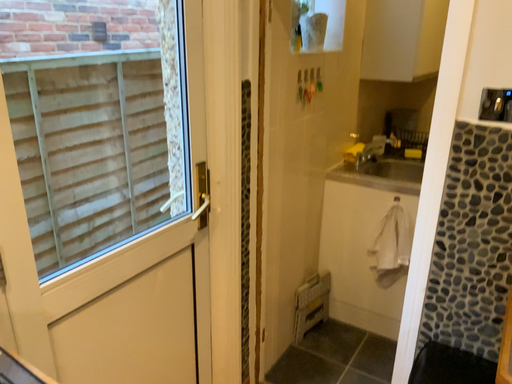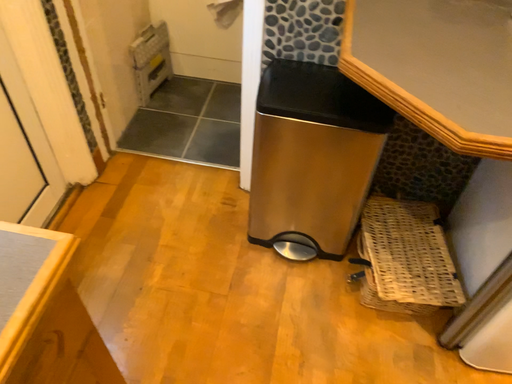
Question: How did the camera likely rotate when shooting the video?

Choices:
 (A) rotated right
 (B) rotated left

Answer: (A)